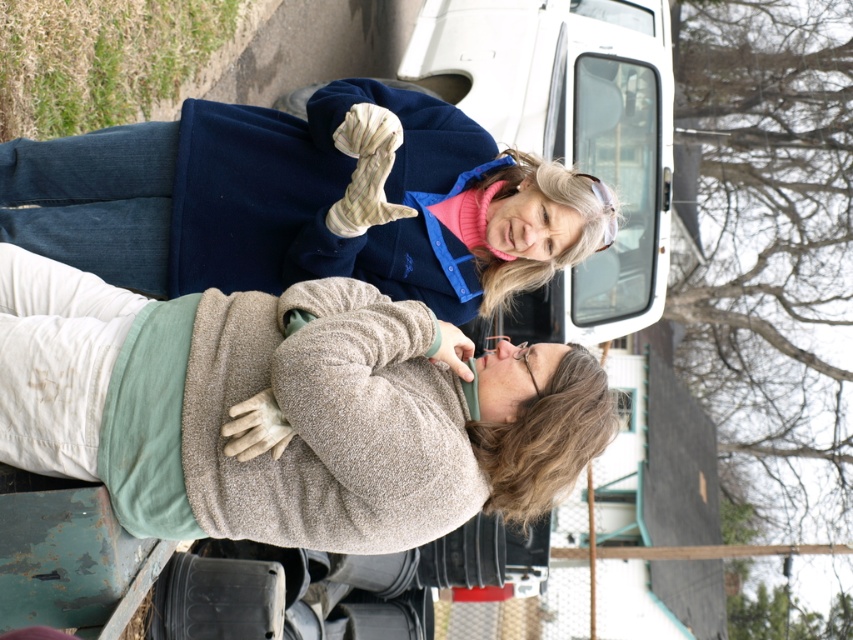
Who is taller, beige fleece sweater at upper center or blue fleece jacket at upper center?

beige fleece sweater at upper center is taller.

Does beige fleece sweater at upper center have a greater width compared to blue fleece jacket at upper center?

Incorrect, beige fleece sweater at upper center's width does not surpass blue fleece jacket at upper center's.

The width and height of the screenshot is (853, 640). I want to click on beige fleece sweater at upper center, so click(283, 410).

You are a GUI agent. You are given a task and a screenshot of the screen. Output one action in this format:
    pyautogui.click(x=<x>, y=<y>)
    Task: Click on the beige fleece sweater at upper center
    This screenshot has width=853, height=640.
    Given the screenshot: What is the action you would take?
    pyautogui.click(x=283, y=410)

Does beige fleece sweater at upper center have a smaller size compared to white matte van at upper center?

Yes.

Which of these two, beige fleece sweater at upper center or white matte van at upper center, stands shorter?

beige fleece sweater at upper center is shorter.

Who is more distant from viewer, (445, 340) or (608, 44)?

Point (608, 44)

You are a GUI agent. You are given a task and a screenshot of the screen. Output one action in this format:
    pyautogui.click(x=<x>, y=<y>)
    Task: Click on the beige fleece sweater at upper center
    The height and width of the screenshot is (640, 853).
    Given the screenshot: What is the action you would take?
    pyautogui.click(x=283, y=410)

Find the location of a particular element. The width and height of the screenshot is (853, 640). blue fleece jacket at upper center is located at coordinates (306, 202).

Does blue fleece jacket at upper center appear under white matte van at upper center?

Indeed, blue fleece jacket at upper center is positioned under white matte van at upper center.

Does point (196, 125) lie behind point (595, 134)?

That is False.

Image resolution: width=853 pixels, height=640 pixels. In order to click on blue fleece jacket at upper center in this screenshot , I will do `click(306, 202)`.